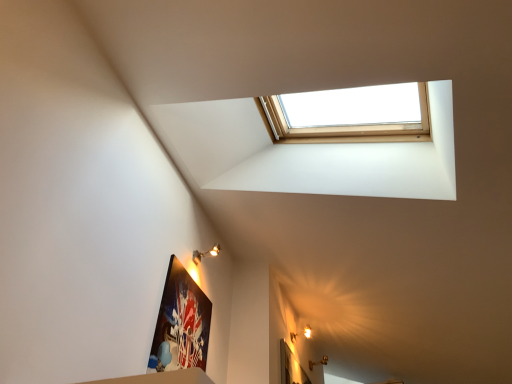
In order to face matte gold light fixture at upper center, positioned as the second light fixture in bottom-to-top order, should I rotate leftwards or rightwards?

To align with it, rotate left about 6.404°.

This screenshot has height=384, width=512. Find the location of `matte gold light fixture at upper center, which ranks as the 2th light fixture in back-to-front order`. matte gold light fixture at upper center, which ranks as the 2th light fixture in back-to-front order is located at coordinates (205, 254).

The width and height of the screenshot is (512, 384). Describe the element at coordinates (307, 332) in the screenshot. I see `matte gold wall sconce at upper right, the second light fixture viewed from the left` at that location.

This screenshot has width=512, height=384. I want to click on matte gold light fixture at upper center, the second light fixture from the right, so click(205, 254).

Which object is further away from the camera, matte black picture frame at lower left or matte gold light fixture at upper center, the first light fixture in the top-to-bottom sequence?

matte gold light fixture at upper center, the first light fixture in the top-to-bottom sequence, is more distant.

From the image's perspective, relative to matte gold light fixture at upper center, which is the 1th light fixture in left-to-right order, is matte black picture frame at lower left above or below?

Based on their image positions, matte black picture frame at lower left is located beneath matte gold light fixture at upper center, which is the 1th light fixture in left-to-right order.

Does matte black picture frame at lower left have a greater width compared to matte gold light fixture at upper center, positioned as the second light fixture in bottom-to-top order?

No.

Between matte black picture frame at lower left and matte gold light fixture at upper center, the first light fixture in the top-to-bottom sequence, which one appears on the right side from the viewer's perspective?

matte gold light fixture at upper center, the first light fixture in the top-to-bottom sequence, is more to the right.

From a real-world perspective, who is located higher, matte gold light fixture at upper center, which ranks as the 2th light fixture in back-to-front order, or matte gold wall sconce at upper right, which is counted as the 1th light fixture, starting from the back?

matte gold light fixture at upper center, which ranks as the 2th light fixture in back-to-front order, is physically above.

Which object is wider, matte gold light fixture at upper center, positioned as the second light fixture in bottom-to-top order, or matte gold wall sconce at upper right, which is counted as the 2th light fixture, starting from the top?

matte gold light fixture at upper center, positioned as the second light fixture in bottom-to-top order.

Is matte gold light fixture at upper center, which ranks as the 2th light fixture in back-to-front order, oriented towards matte gold wall sconce at upper right, which ranks as the second light fixture in front-to-back order?

No, matte gold light fixture at upper center, which ranks as the 2th light fixture in back-to-front order, is not facing towards matte gold wall sconce at upper right, which ranks as the second light fixture in front-to-back order.

Which of these two, matte gold wall sconce at upper right, which ranks as the second light fixture in front-to-back order, or matte black picture frame at lower left, is thinner?

matte black picture frame at lower left.

Is matte gold wall sconce at upper right, which is counted as the 1th light fixture, starting from the back, facing towards matte black picture frame at lower left?

No, matte gold wall sconce at upper right, which is counted as the 1th light fixture, starting from the back, is not oriented towards matte black picture frame at lower left.

Which point is more forward, (x=306, y=336) or (x=175, y=280)?

The point (x=175, y=280) is more forward.

Does matte gold wall sconce at upper right, the second light fixture viewed from the left, appear on the left side of matte black picture frame at lower left?

No, matte gold wall sconce at upper right, the second light fixture viewed from the left, is not to the left of matte black picture frame at lower left.

You are a GUI agent. You are given a task and a screenshot of the screen. Output one action in this format:
    pyautogui.click(x=<x>, y=<y>)
    Task: Click on the light fixture located below the matte black picture frame at lower left (from the image's perspective)
    The width and height of the screenshot is (512, 384).
    Given the screenshot: What is the action you would take?
    pyautogui.click(x=307, y=332)

From the image's perspective, would you say matte black picture frame at lower left is shown under matte gold wall sconce at upper right, which is counted as the 1th light fixture, starting from the back?

Incorrect, from the image's perspective, matte black picture frame at lower left is higher than matte gold wall sconce at upper right, which is counted as the 1th light fixture, starting from the back.

How much distance is there between matte black picture frame at lower left and matte gold wall sconce at upper right, the 1th light fixture when ordered from right to left?

5.10 feet.

Is matte black picture frame at lower left surrounding matte gold wall sconce at upper right, the 1th light fixture when ordered from right to left?

No.

From the image's perspective, is matte gold wall sconce at upper right, the 1th light fixture when ordered from right to left, located above or below matte gold light fixture at upper center, the first light fixture in the top-to-bottom sequence?

Clearly, from the image's perspective, matte gold wall sconce at upper right, the 1th light fixture when ordered from right to left, is below matte gold light fixture at upper center, the first light fixture in the top-to-bottom sequence.

How many degrees apart are the facing directions of matte gold wall sconce at upper right, the 1th light fixture when ordered from right to left, and matte gold light fixture at upper center, which ranks as the 2th light fixture in back-to-front order?

The facing directions of matte gold wall sconce at upper right, the 1th light fixture when ordered from right to left, and matte gold light fixture at upper center, which ranks as the 2th light fixture in back-to-front order, are 0.00159 degrees apart.

Is matte gold wall sconce at upper right, the 1th light fixture when ordered from right to left, located outside matte gold light fixture at upper center, the first light fixture in the top-to-bottom sequence?

Indeed, matte gold wall sconce at upper right, the 1th light fixture when ordered from right to left, is completely outside matte gold light fixture at upper center, the first light fixture in the top-to-bottom sequence.

From a real-world perspective, is matte gold wall sconce at upper right, which is counted as the 1th light fixture, starting from the back, located beneath matte gold light fixture at upper center, which is the 1th light fixture in left-to-right order?

Yes, from a real-world perspective, matte gold wall sconce at upper right, which is counted as the 1th light fixture, starting from the back, is under matte gold light fixture at upper center, which is the 1th light fixture in left-to-right order.

From the picture: Is matte gold light fixture at upper center, the first light fixture in the top-to-bottom sequence, looking in the opposite direction of matte black picture frame at lower left?

No, matte gold light fixture at upper center, the first light fixture in the top-to-bottom sequence,'s orientation is not away from matte black picture frame at lower left.

Where is `picture frame below the matte gold light fixture at upper center, which ranks as the 2th light fixture in back-to-front order (from a real-world perspective)`? This screenshot has width=512, height=384. picture frame below the matte gold light fixture at upper center, which ranks as the 2th light fixture in back-to-front order (from a real-world perspective) is located at coordinates (181, 323).

Looking at this image, could matte black picture frame at lower left be considered to be inside matte gold light fixture at upper center, positioned as the second light fixture in bottom-to-top order?

No, matte black picture frame at lower left is not a part of matte gold light fixture at upper center, positioned as the second light fixture in bottom-to-top order.

How different are the orientations of matte gold light fixture at upper center, the first light fixture in the top-to-bottom sequence, and matte black picture frame at lower left in degrees?

There is a 0.00727-degree angle between the facing directions of matte gold light fixture at upper center, the first light fixture in the top-to-bottom sequence, and matte black picture frame at lower left.

Locate an element on the screen. The height and width of the screenshot is (384, 512). picture frame in front of the matte gold light fixture at upper center, positioned as the second light fixture in bottom-to-top order is located at coordinates (181, 323).

Where is `light fixture above the matte gold wall sconce at upper right, the 1th light fixture when ordered from right to left (from a real-world perspective)`? light fixture above the matte gold wall sconce at upper right, the 1th light fixture when ordered from right to left (from a real-world perspective) is located at coordinates (205, 254).

Based on their spatial positions, is matte black picture frame at lower left or matte gold light fixture at upper center, the second light fixture from the right, closer to matte gold wall sconce at upper right, the second light fixture viewed from the left?

matte gold light fixture at upper center, the second light fixture from the right.

Estimate the real-world distances between objects in this image. Which object is closer to matte gold light fixture at upper center, the first light fixture in the top-to-bottom sequence, matte black picture frame at lower left or matte gold wall sconce at upper right, positioned as the first light fixture in bottom-to-top order?

matte black picture frame at lower left is positioned closer to the anchor matte gold light fixture at upper center, the first light fixture in the top-to-bottom sequence.

From the picture: Considering their positions, is matte gold light fixture at upper center, the second light fixture from the right, positioned closer to matte gold wall sconce at upper right, which is counted as the 1th light fixture, starting from the back, than matte black picture frame at lower left?

matte gold light fixture at upper center, the second light fixture from the right.

Considering their positions, is matte gold wall sconce at upper right, positioned as the first light fixture in bottom-to-top order, positioned further to matte gold light fixture at upper center, the first light fixture in the top-to-bottom sequence, than matte black picture frame at lower left?

matte gold wall sconce at upper right, positioned as the first light fixture in bottom-to-top order, lies further to matte gold light fixture at upper center, the first light fixture in the top-to-bottom sequence, than the other object.

Considering their positions, is matte gold wall sconce at upper right, which is counted as the 1th light fixture, starting from the back, positioned further to matte black picture frame at lower left than matte gold light fixture at upper center, which is the 1th light fixture in front-to-back order?

matte gold wall sconce at upper right, which is counted as the 1th light fixture, starting from the back.

In the scene shown: Estimate the real-world distances between objects in this image. Which object is closer to matte black picture frame at lower left, matte gold light fixture at upper center, which ranks as the 2th light fixture in back-to-front order, or matte gold wall sconce at upper right, which is counted as the 2th light fixture, starting from the top?

matte gold light fixture at upper center, which ranks as the 2th light fixture in back-to-front order, lies closer to matte black picture frame at lower left than the other object.

What are the coordinates of `light fixture between matte black picture frame at lower left and matte gold wall sconce at upper right, the 1th light fixture when ordered from right to left, from front to back` in the screenshot? It's located at click(205, 254).